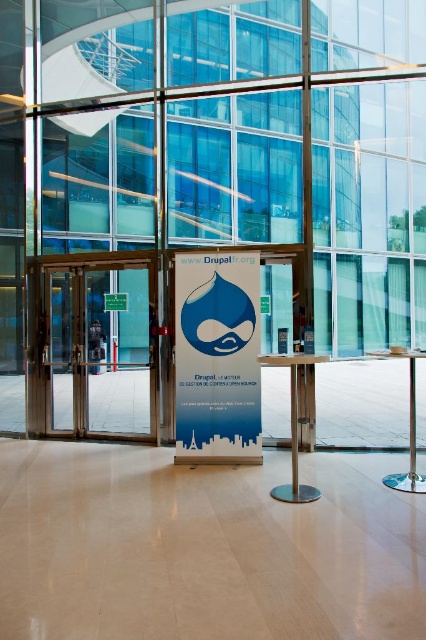
You are standing in the modern building and want to exit through the transparent glass door at center. Based on the coordinates provided, can you determine if the door is positioned centrally in the room?

The transparent glass door at center is located at coordinates point [100,348], which suggests it is positioned centrally in the room.

You are a delivery person with a 4 feet wide cart. You need to move your cart through the space between the blue paper sign at center and the green plastic sign at center. Can your cart fit through the space between them?

The blue paper sign at center and green plastic sign at center are 4.35 feet apart from each other, so yes, the cart can fit through the space between them since it is wider than the cart.

You are a delivery person entering the building and need to locate the reception desk. The reception desk is behind either the transparent glass door at center or the blue paper sign at center. Based on their sizes, which one is more likely to be the entrance to the reception area?

The transparent glass door at center is much taller than the blue paper sign at center, so the transparent glass door at center is more likely to be the entrance to the reception area since doors are typically taller than signs.